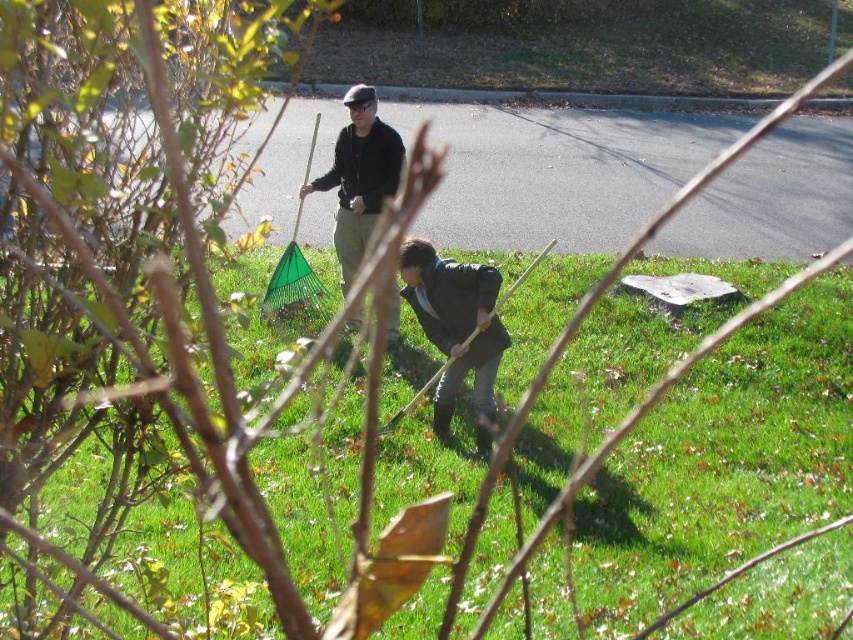
You are a gardener looking at the scene. You need to determine which object is taller between the green grass at center and the matte black jacket at center. Which one is taller?

The matte black jacket at center is taller than the green grass at center.

You are standing in the yard and see the green grass at center and the dark blue suit at lower center. Which object is positioned to the right of the other?

The green grass at center is to the right of the dark blue suit at lower center.